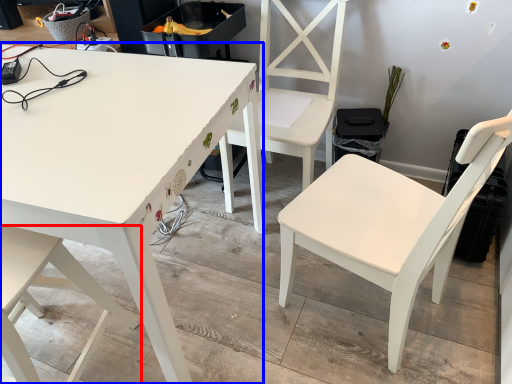
Question: Among these objects, which one is farthest to the camera, chair (highlighted by a red box) or table (highlighted by a blue box)?

Choices:
 (A) chair
 (B) table

Answer: (B)